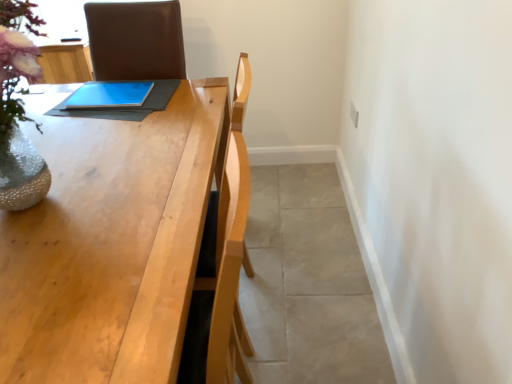
Measure the distance between blue matte tablet at center and camera.

1.60 meters.

Describe the element at coordinates (110, 242) in the screenshot. I see `light wood table at center` at that location.

The image size is (512, 384). What are the coordinates of `gray tile floor at lower right` in the screenshot? It's located at (308, 283).

This screenshot has width=512, height=384. What do you see at coordinates (308, 283) in the screenshot?
I see `gray tile floor at lower right` at bounding box center [308, 283].

What are the coordinates of `blue matte tablet at center` in the screenshot? It's located at (109, 95).

Where is `concrete on the right of blue matte tablet at center`? This screenshot has height=384, width=512. concrete on the right of blue matte tablet at center is located at coordinates (308, 283).

How many degrees apart are the facing directions of blue matte tablet at center and gray tile floor at lower right?

1.35 degrees separate the facing orientations of blue matte tablet at center and gray tile floor at lower right.

Can you confirm if blue matte tablet at center is positioned to the right of gray tile floor at lower right?

In fact, blue matte tablet at center is to the left of gray tile floor at lower right.

From the image's perspective, is gray tile floor at lower right below blue matte tablet at center?

Yes, from the image's perspective, gray tile floor at lower right is beneath blue matte tablet at center.

Where is `concrete below the blue matte tablet at center (from the image's perspective)`? The width and height of the screenshot is (512, 384). concrete below the blue matte tablet at center (from the image's perspective) is located at coordinates (308, 283).

Does gray tile floor at lower right have a greater width compared to blue matte tablet at center?

Yes, gray tile floor at lower right is wider than blue matte tablet at center.

Can you tell me how much gray tile floor at lower right and blue matte tablet at center differ in facing direction?

1.35 degrees.

Does blue matte tablet at center have a larger size compared to light wood table at center?

Actually, blue matte tablet at center might be smaller than light wood table at center.

Between blue matte tablet at center and light wood table at center, which one appears on the left side from the viewer's perspective?

Positioned to the left is blue matte tablet at center.

Is point (106, 84) closer or farther from the camera than point (191, 164)?

Point (106, 84) is positioned farther from the camera compared to point (191, 164).

From the image's perspective, is light wood table at center below blue matte tablet at center?

Indeed, from the image's perspective, light wood table at center is shown beneath blue matte tablet at center.

Is light wood table at center thinner than blue matte tablet at center?

In fact, light wood table at center might be wider than blue matte tablet at center.

Considering the positions of objects light wood table at center and blue matte tablet at center in the image provided, who is in front, light wood table at center or blue matte tablet at center?

light wood table at center.

Considering the positions of points (100, 163) and (71, 103), is point (100, 163) closer to camera compared to point (71, 103)?

That is True.

Based on the photo, is light wood table at center far away from gray tile floor at lower right?

No, there isn't a large distance between light wood table at center and gray tile floor at lower right.

Considering the relative sizes of light wood table at center and gray tile floor at lower right in the image provided, is light wood table at center shorter than gray tile floor at lower right?

Incorrect, the height of light wood table at center does not fall short of that of gray tile floor at lower right.

Is light wood table at center to the left of gray tile floor at lower right from the viewer's perspective?

Yes.

In terms of width, does gray tile floor at lower right look wider or thinner when compared to light wood table at center?

Considering their sizes, gray tile floor at lower right looks broader than light wood table at center.

Does gray tile floor at lower right appear on the left side of light wood table at center?

No.

Based on the photo, from the image's perspective, would you say gray tile floor at lower right is shown under light wood table at center?

No, from the image's perspective, gray tile floor at lower right is not beneath light wood table at center.

Can you see gray tile floor at lower right touching light wood table at center?

No, gray tile floor at lower right is not next to light wood table at center.

Identify the location of concrete directly beneath the blue matte tablet at center (from a real-world perspective). (308, 283).

I want to click on tablet computer behind the gray tile floor at lower right, so click(109, 95).

In the scene shown: When comparing their distances from blue matte tablet at center, does light wood table at center or gray tile floor at lower right seem further?

gray tile floor at lower right is further to blue matte tablet at center.

Estimate the real-world distances between objects in this image. Which object is further from light wood table at center, gray tile floor at lower right or blue matte tablet at center?

gray tile floor at lower right.

When comparing their distances from blue matte tablet at center, does gray tile floor at lower right or light wood table at center seem further?

gray tile floor at lower right is positioned further to the anchor blue matte tablet at center.

Considering their positions, is blue matte tablet at center positioned further to gray tile floor at lower right than light wood table at center?

Based on the image, blue matte tablet at center appears to be further to gray tile floor at lower right.

Estimate the real-world distances between objects in this image. Which object is closer to light wood table at center, blue matte tablet at center or gray tile floor at lower right?

blue matte tablet at center.

From the image, which object appears to be farther from gray tile floor at lower right, light wood table at center or blue matte tablet at center?

blue matte tablet at center is further to gray tile floor at lower right.

You are a GUI agent. You are given a task and a screenshot of the screen. Output one action in this format:
    pyautogui.click(x=<x>, y=<y>)
    Task: Click on the concrete between light wood table at center and blue matte tablet at center from front to back
    This screenshot has height=384, width=512.
    Given the screenshot: What is the action you would take?
    pyautogui.click(x=308, y=283)